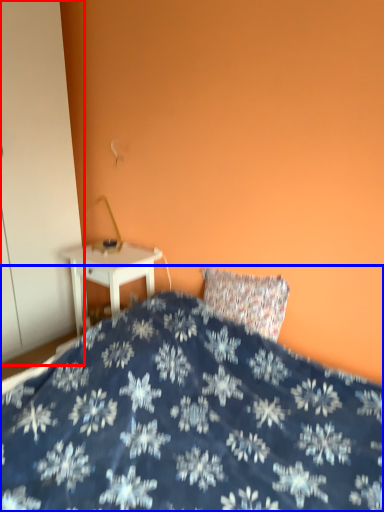
Question: Which of the following is the farthest to the observer, armoire (highlighted by a red box) or bed (highlighted by a blue box)?

Choices:
 (A) armoire
 (B) bed

Answer: (A)